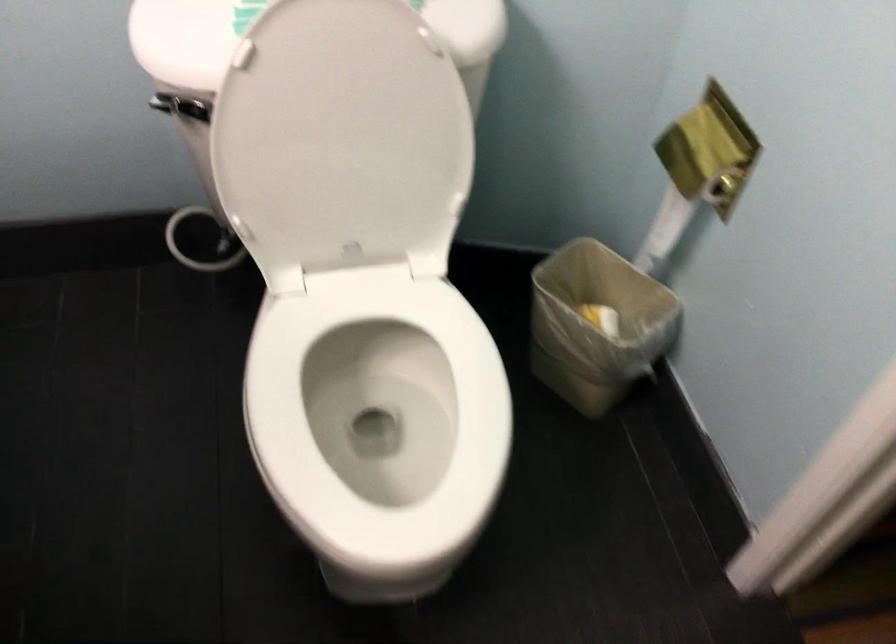
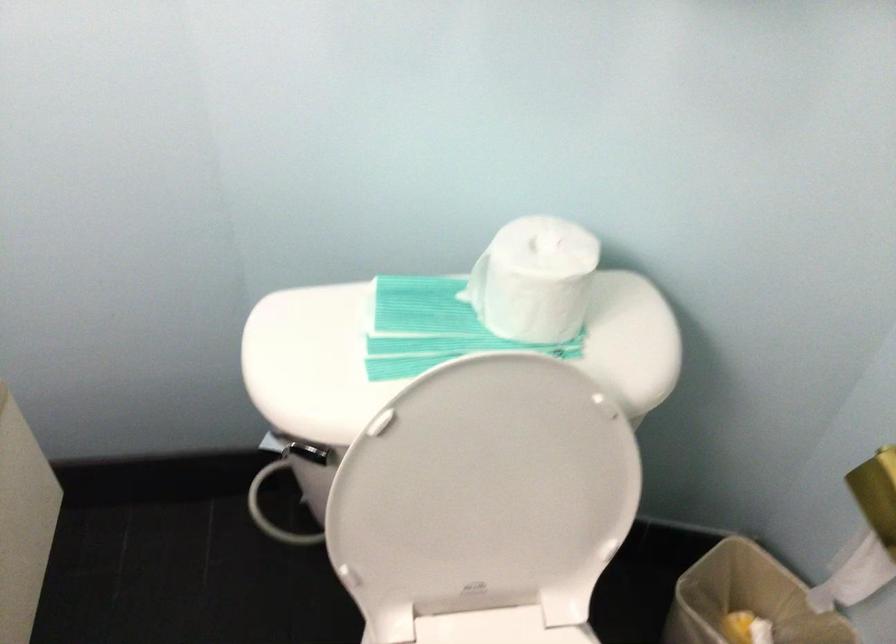
Find the pixel in the second image that matches the point at 371,277 in the first image.

(497, 627)